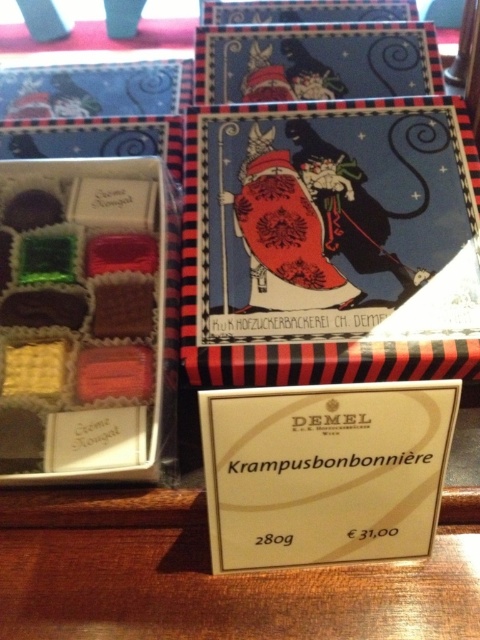
Question: Does matte red box at upper center have a larger size compared to matte chocolate box at center?

Choices:
 (A) yes
 (B) no

Answer: (A)

Question: Which point is closer to the camera taking this photo?

Choices:
 (A) (131, 291)
 (B) (289, 362)

Answer: (B)

Question: Among these objects, which one is farthest from the camera?

Choices:
 (A) matte chocolate box at center
 (B) matte red box at upper center

Answer: (B)

Question: Observing the image, what is the correct spatial positioning of matte red box at upper center in reference to matte chocolate box at center?

Choices:
 (A) right
 (B) left

Answer: (A)

Question: Does matte red box at upper center come in front of matte chocolate box at center?

Choices:
 (A) yes
 (B) no

Answer: (B)